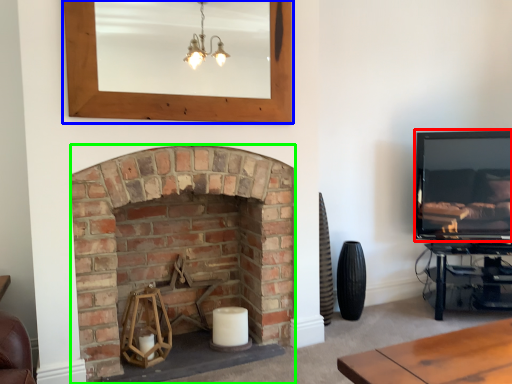
Question: Based on their relative distances, which object is nearer to television (highlighted by a red box)? Choose from picture frame (highlighted by a blue box) and fireplace (highlighted by a green box).

Choices:
 (A) picture frame
 (B) fireplace

Answer: (A)